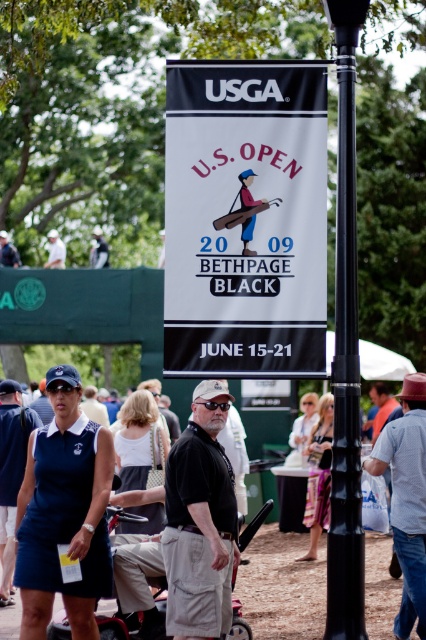
Question: Is navy blue fabric dress at center thinner than black metal pole at center?

Choices:
 (A) no
 (B) yes

Answer: (A)

Question: Does black metal pole at center lie behind red plastic baby carriage at lower center?

Choices:
 (A) yes
 (B) no

Answer: (B)

Question: Which point is farther from the camera taking this photo?

Choices:
 (A) (51, 264)
 (B) (293, 628)
 (C) (86, 513)
 (D) (58, 634)

Answer: (A)

Question: Which point is farther from the camera taking this photo?

Choices:
 (A) (265, 548)
 (B) (63, 248)

Answer: (B)

Question: Which of the following is the farthest from the observer?

Choices:
 (A) navy blue fabric dress at center
 (B) red plastic baby carriage at lower center
 (C) navy blue uniform at lower left

Answer: (C)

Question: Observing the image, what is the correct spatial positioning of black metal pole at center in reference to white cotton shirt at upper left?

Choices:
 (A) above
 (B) below

Answer: (B)